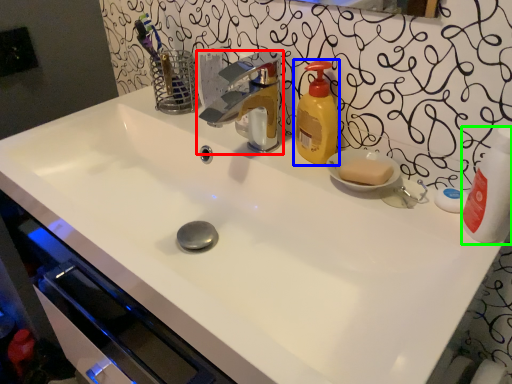
Question: Based on their relative distances, which object is farther from tap (highlighted by a red box)? Choose from soap dispenser (highlighted by a blue box) and cleaning product (highlighted by a green box).

Choices:
 (A) soap dispenser
 (B) cleaning product

Answer: (B)